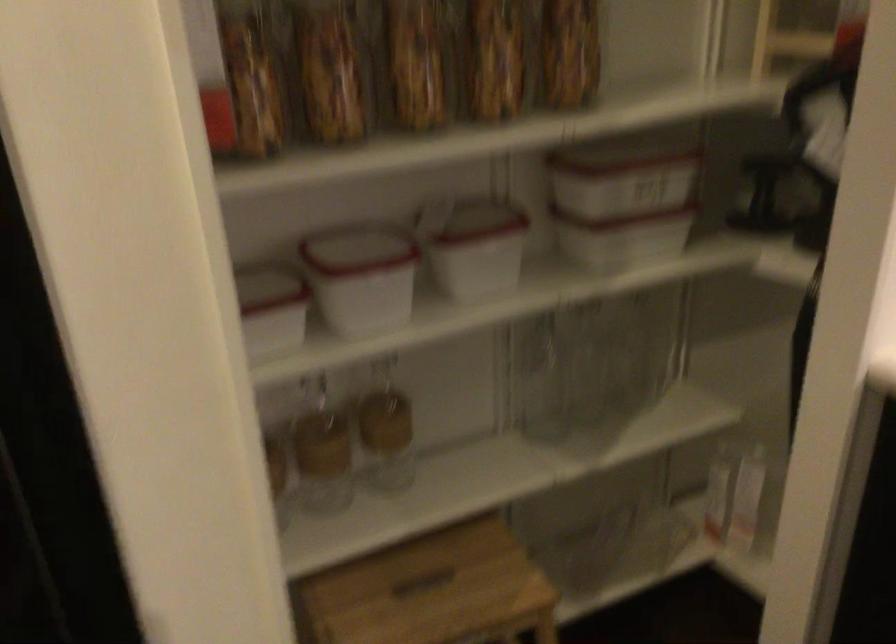
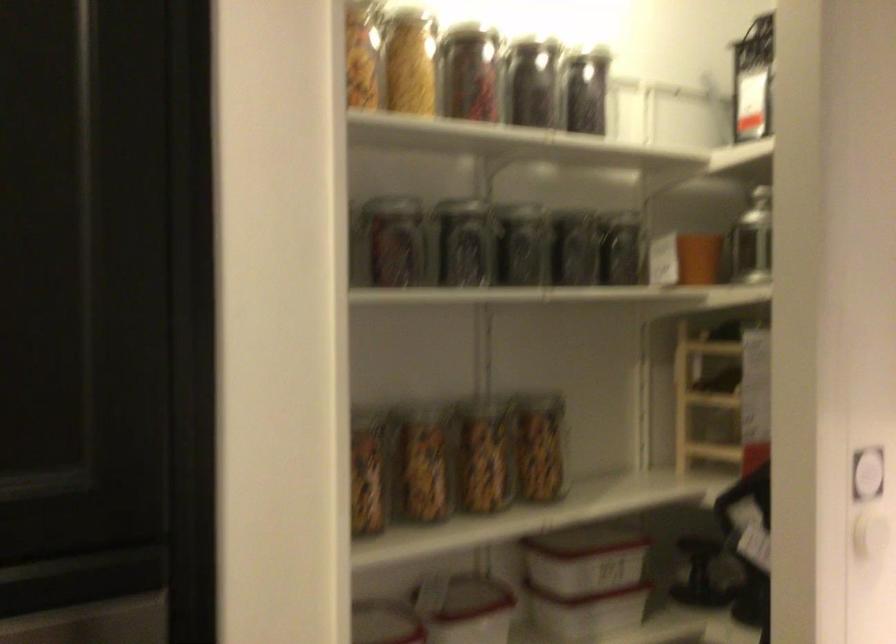
Where in the second image is the point corresponding to pixel 479 232 from the first image?

(464, 605)